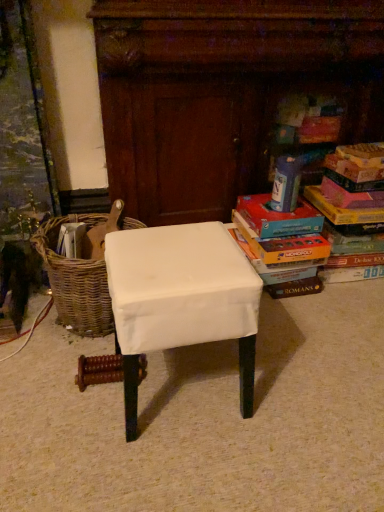
The width and height of the screenshot is (384, 512). In order to click on free location above matte cardboard book at right, which ranks as the second book in right-to-left order (from a real-world perspective) in this screenshot , I will do `click(269, 209)`.